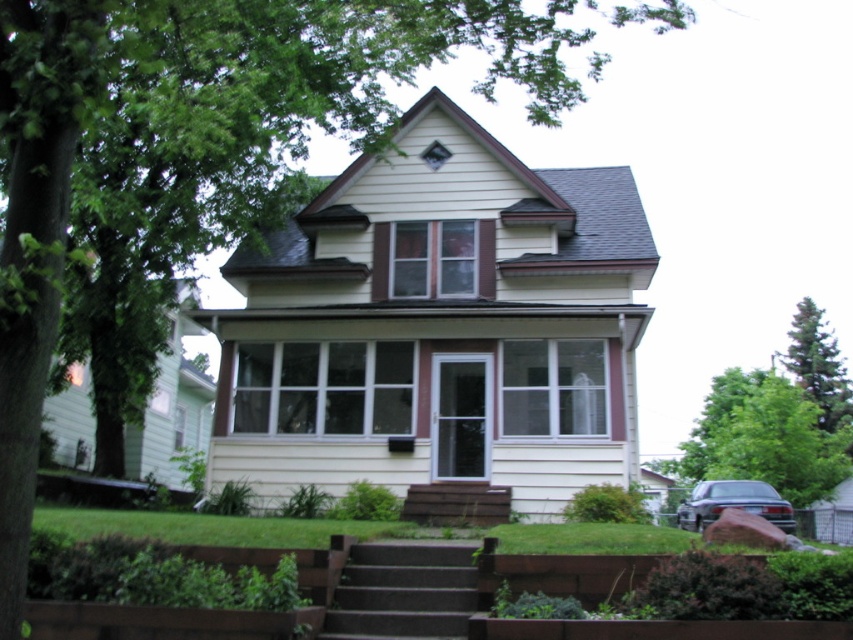
Question: Is brown stone stairs at lower center in front of brown wooden stairs at center?

Choices:
 (A) yes
 (B) no

Answer: (A)

Question: Can you confirm if brown stone stairs at lower center is thinner than green textured pine tree at upper right?

Choices:
 (A) no
 (B) yes

Answer: (B)

Question: Which point is farther to the camera?

Choices:
 (A) (817, 449)
 (B) (451, 497)
 (C) (405, 556)

Answer: (A)

Question: Considering the real-world distances, which object is closest to the green textured pine tree at upper right?

Choices:
 (A) brown wooden stairs at center
 (B) green leafy tree at right

Answer: (B)

Question: Which of the following is the farthest from the observer?

Choices:
 (A) brown stone stairs at lower center
 (B) brown wooden stairs at center
 (C) green leafy tree at right

Answer: (C)

Question: Does green textured pine tree at upper right appear on the right side of brown wooden stairs at center?

Choices:
 (A) no
 (B) yes

Answer: (B)